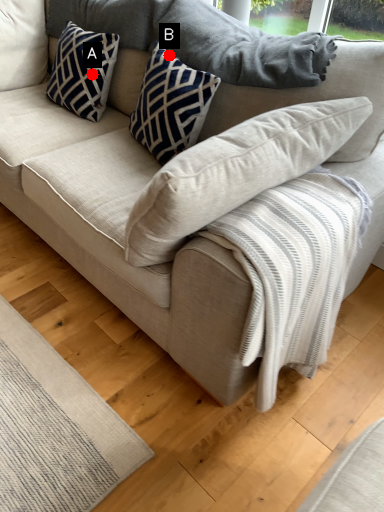
Question: Two points are circled on the image, labeled by A and B beside each circle. Which of the following is the closest to the observer?

Choices:
 (A) A is closer
 (B) B is closer

Answer: (B)